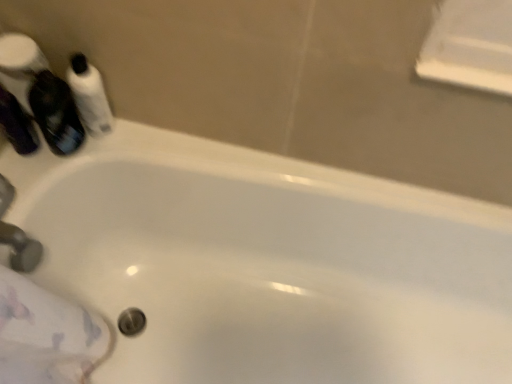
Question: Is matte silver faucet at lower left completely or partially outside of translucent purple mouthwash at upper left, which is the second mouthwash from left to right?

Choices:
 (A) yes
 (B) no

Answer: (A)

Question: Is matte silver faucet at lower left smaller than translucent purple mouthwash at upper left, positioned as the 2th mouthwash in right-to-left order?

Choices:
 (A) no
 (B) yes

Answer: (B)

Question: Can you confirm if matte silver faucet at lower left is taller than translucent purple mouthwash at upper left, positioned as the 2th mouthwash in right-to-left order?

Choices:
 (A) yes
 (B) no

Answer: (B)

Question: Is matte silver faucet at lower left positioned in front of translucent purple mouthwash at upper left, which is the second mouthwash from left to right?

Choices:
 (A) no
 (B) yes

Answer: (B)

Question: From a real-world perspective, does matte silver faucet at lower left sit lower than translucent purple mouthwash at upper left, which is the second mouthwash from left to right?

Choices:
 (A) yes
 (B) no

Answer: (A)

Question: Visually, is white glossy mouthwash at upper left, the first mouthwash viewed from the right, positioned to the left or to the right of matte silver faucet at lower left?

Choices:
 (A) right
 (B) left

Answer: (A)

Question: Is point (96, 84) positioned closer to the camera than point (7, 238)?

Choices:
 (A) farther
 (B) closer

Answer: (A)

Question: From the image's perspective, is white glossy mouthwash at upper left, which appears as the 3th mouthwash when viewed from the left, located above or below matte silver faucet at lower left?

Choices:
 (A) above
 (B) below

Answer: (A)

Question: From a real-world perspective, is white glossy mouthwash at upper left, the first mouthwash viewed from the right, physically located above or below matte silver faucet at lower left?

Choices:
 (A) below
 (B) above

Answer: (B)

Question: Does point (28, 127) appear closer or farther from the camera than point (74, 150)?

Choices:
 (A) farther
 (B) closer

Answer: (B)

Question: Looking at the image, does matte black bottle at left, the 1th mouthwash viewed from the left, seem bigger or smaller compared to translucent purple mouthwash at upper left, which is the second mouthwash from left to right?

Choices:
 (A) small
 (B) big

Answer: (A)

Question: In the image, is matte black bottle at left, marked as the 3th mouthwash in a right-to-left arrangement, positioned in front of or behind translucent purple mouthwash at upper left, positioned as the 2th mouthwash in right-to-left order?

Choices:
 (A) behind
 (B) front

Answer: (A)

Question: Based on their positions, is matte black bottle at left, the 1th mouthwash viewed from the left, located to the left or right of translucent purple mouthwash at upper left, positioned as the 2th mouthwash in right-to-left order?

Choices:
 (A) left
 (B) right

Answer: (A)

Question: Is point (31, 107) positioned closer to the camera than point (14, 251)?

Choices:
 (A) farther
 (B) closer

Answer: (B)

Question: Considering the positions of translucent purple mouthwash at upper left, positioned as the 2th mouthwash in right-to-left order, and matte silver faucet at lower left in the image, is translucent purple mouthwash at upper left, positioned as the 2th mouthwash in right-to-left order, taller or shorter than matte silver faucet at lower left?

Choices:
 (A) short
 (B) tall

Answer: (B)